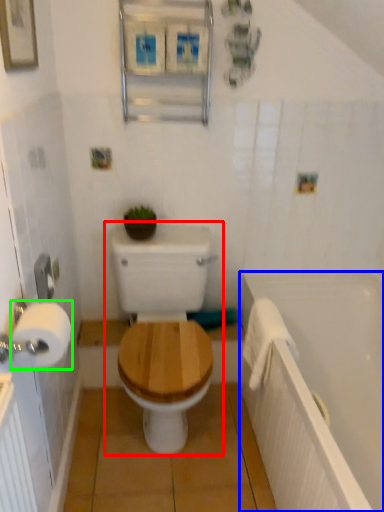
Question: Which is nearer to the toilet (highlighted by a red box)? bath (highlighted by a blue box) or toilet paper (highlighted by a green box).

Choices:
 (A) bath
 (B) toilet paper

Answer: (A)